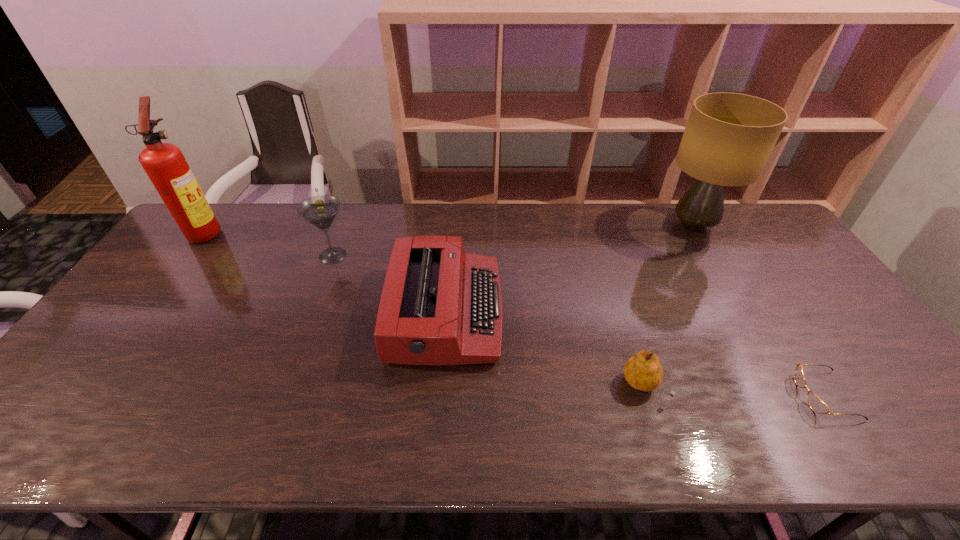
Identify the location of fire extinguisher. (164, 163).

Identify the location of lampshade. Image resolution: width=960 pixels, height=540 pixels. click(x=729, y=137).

The height and width of the screenshot is (540, 960). I want to click on the fifth object from right to left, so click(x=321, y=210).

The width and height of the screenshot is (960, 540). I want to click on martini, so (321, 210).

At what (x,y) coordinates should I click in order to perform the action: click on typewriter. Please return your answer as a coordinate pair (x, y). This screenshot has width=960, height=540. Looking at the image, I should click on [x=439, y=305].

The image size is (960, 540). I want to click on pear, so click(x=644, y=372).

Find the location of a particular element. The height and width of the screenshot is (540, 960). the shortest object is located at coordinates (816, 404).

Locate an element on the screen. free space located on the front-facing side of the leftmost object is located at coordinates (331, 232).

You are a GUI agent. You are given a task and a screenshot of the screen. Output one action in this format:
    pyautogui.click(x=<x>, y=<y>)
    Task: Click on the vacant position located 0.250m on the left of the lampshade
    This screenshot has width=960, height=540.
    Given the screenshot: What is the action you would take?
    pyautogui.click(x=586, y=226)

Locate an element on the screen. The width and height of the screenshot is (960, 540). vacant area situated on the back of the third tallest object is located at coordinates (348, 217).